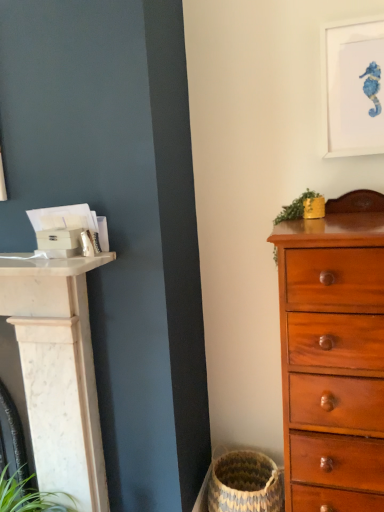
Question: Is white matte picture frame at upper right bigger than green leafy plant at upper right?

Choices:
 (A) no
 (B) yes

Answer: (B)

Question: Is white matte picture frame at upper right aimed at green leafy plant at upper right?

Choices:
 (A) no
 (B) yes

Answer: (A)

Question: Is white matte picture frame at upper right looking in the opposite direction of green leafy plant at upper right?

Choices:
 (A) no
 (B) yes

Answer: (A)

Question: Is white matte picture frame at upper right in contact with green leafy plant at upper right?

Choices:
 (A) yes
 (B) no

Answer: (B)

Question: Is white matte picture frame at upper right surrounding green leafy plant at upper right?

Choices:
 (A) no
 (B) yes

Answer: (A)

Question: Considering the positions of natural woven basket at lower center and white matte picture frame at upper right in the image, is natural woven basket at lower center bigger or smaller than white matte picture frame at upper right?

Choices:
 (A) small
 (B) big

Answer: (B)

Question: Is natural woven basket at lower center wider or thinner than white matte picture frame at upper right?

Choices:
 (A) wide
 (B) thin

Answer: (A)

Question: In the image, is natural woven basket at lower center positioned in front of or behind white matte picture frame at upper right?

Choices:
 (A) behind
 (B) front

Answer: (A)

Question: Considering the positions of point (246, 501) and point (332, 93), is point (246, 501) closer or farther from the camera than point (332, 93)?

Choices:
 (A) farther
 (B) closer

Answer: (A)

Question: Is point (261, 490) closer or farther from the camera than point (289, 313)?

Choices:
 (A) closer
 (B) farther

Answer: (B)

Question: Considering the positions of natural woven basket at lower center and mahogany wooden chest of drawers at right in the image, is natural woven basket at lower center wider or thinner than mahogany wooden chest of drawers at right?

Choices:
 (A) wide
 (B) thin

Answer: (B)

Question: From the image's perspective, is natural woven basket at lower center located above or below mahogany wooden chest of drawers at right?

Choices:
 (A) above
 (B) below

Answer: (B)

Question: Based on their sizes in the image, would you say natural woven basket at lower center is bigger or smaller than mahogany wooden chest of drawers at right?

Choices:
 (A) big
 (B) small

Answer: (B)

Question: From a real-world perspective, relative to green leafy plant at upper right, is white matte picture frame at upper right vertically above or below?

Choices:
 (A) above
 (B) below

Answer: (A)

Question: Is white matte picture frame at upper right situated inside green leafy plant at upper right or outside?

Choices:
 (A) outside
 (B) inside

Answer: (A)